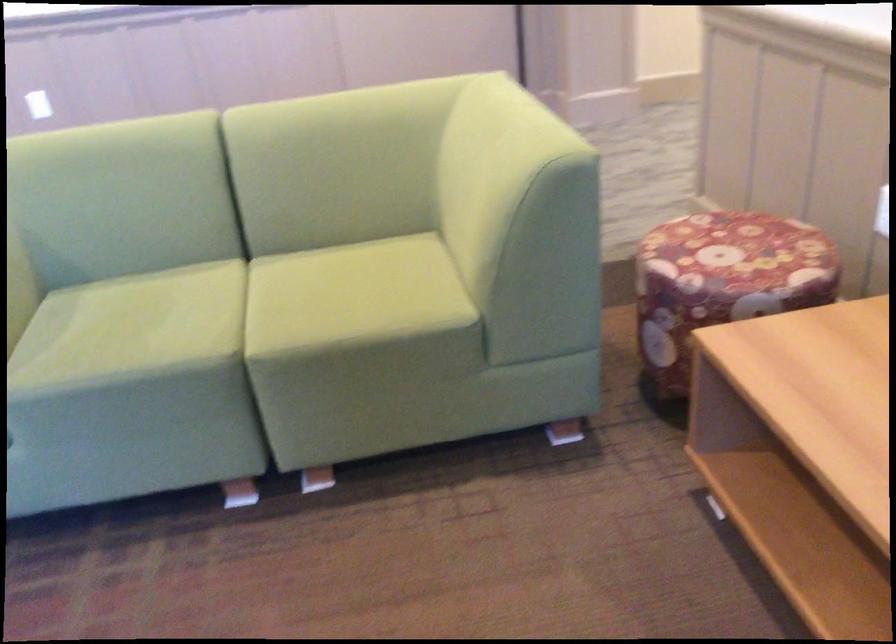
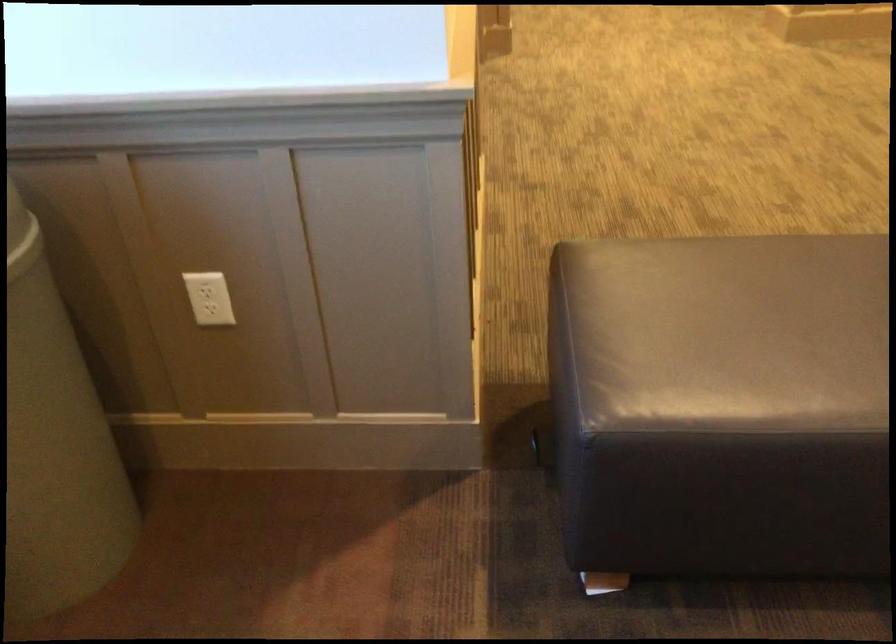
Based on the continuous images, in which direction is the camera rotating?

The camera's rotation is toward left-down.